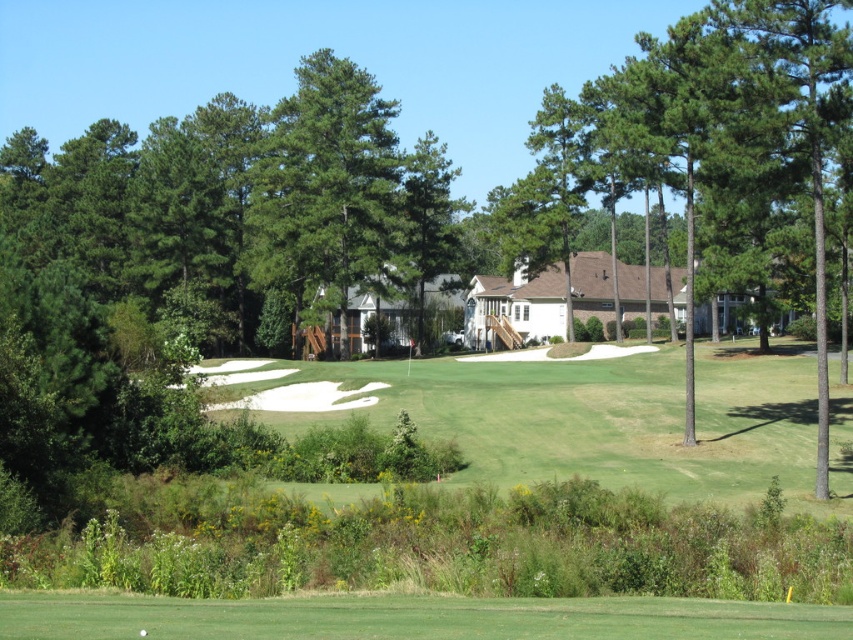
From the picture: You are a golfer standing on the green grass at lower center and want to hit the ball towards the green grassy fairway at center. Which area has taller grass to aim for?

The green grassy fairway at center is taller than the green grass at lower center, so you should aim for the green grassy fairway at center as it has taller grass.

You are a golfer standing on the green grass at lower center and want to hit the ball towards the green leafy tree at center. Considering the height difference between the two, will the tree block your view of the ball once it reaches the tree?

The green grass at lower center is shorter than the green leafy tree at center. Since the tree is taller, it may block your view of the ball once it reaches the tree.